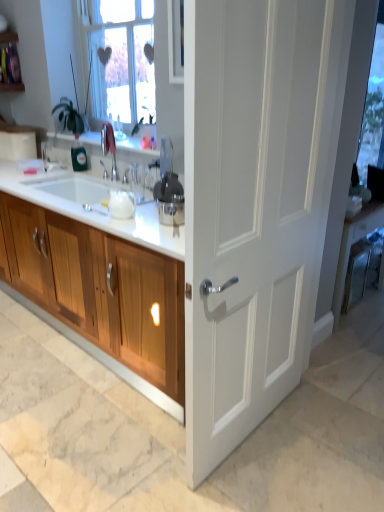
Where is `free region on the left part of white matte door at center`? free region on the left part of white matte door at center is located at coordinates (125, 441).